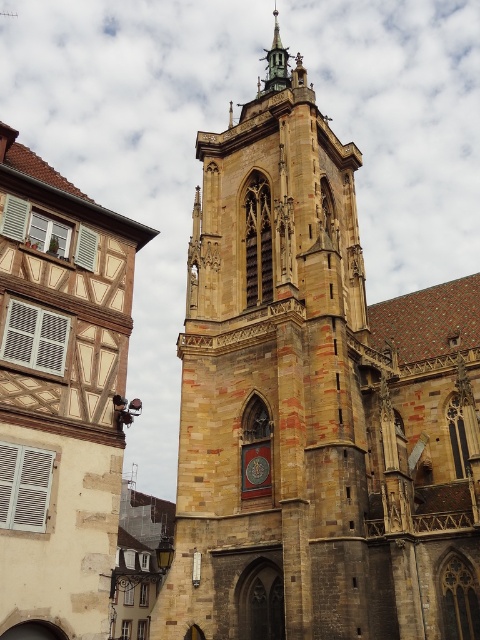
Between point (205, 282) and point (280, 90), which one is positioned in front?

Point (205, 282) is in front.

Measure the distance between point (406, 387) and camera.

57.73 meters

Locate an element on the screen. brown stone tower at center is located at coordinates (315, 408).

Identify the location of brown stone tower at center. (315, 408).

Between wooden half-timbered house at left and polished copper spire at upper center, which one appears on the right side from the viewer's perspective?

Positioned to the right is polished copper spire at upper center.

Who is more forward, (10, 397) or (282, 45)?

Point (10, 397) is more forward.

Where is `wooden half-timbered house at left`? wooden half-timbered house at left is located at coordinates (60, 396).

Identify the location of wooden half-timbered house at left. The image size is (480, 640). (60, 396).

Can you confirm if brown stone tower at center is wider than wooden half-timbered house at left?

Indeed, brown stone tower at center has a greater width compared to wooden half-timbered house at left.

Is point (377, 324) closer to camera compared to point (6, 484)?

That is False.

Identify the location of brown stone tower at center. (315, 408).